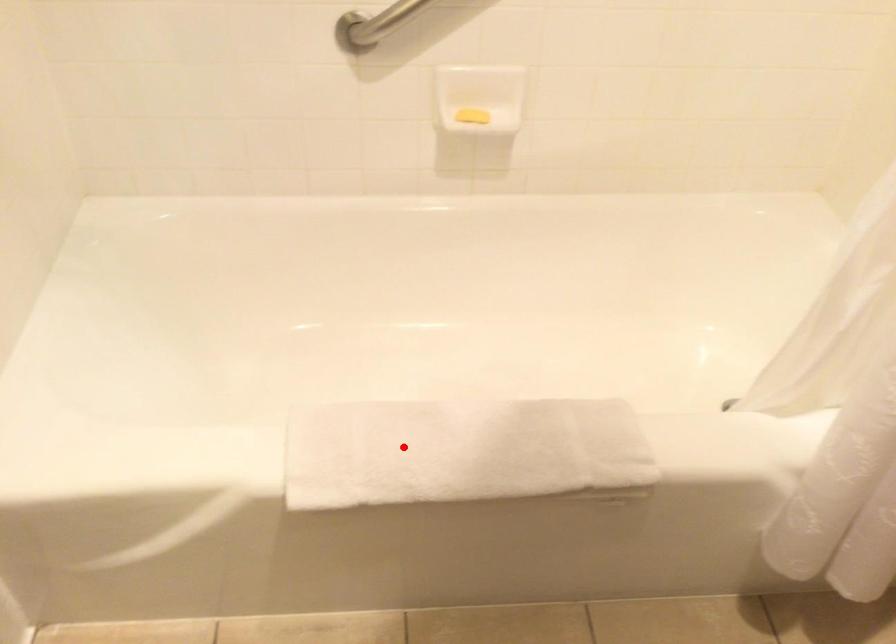
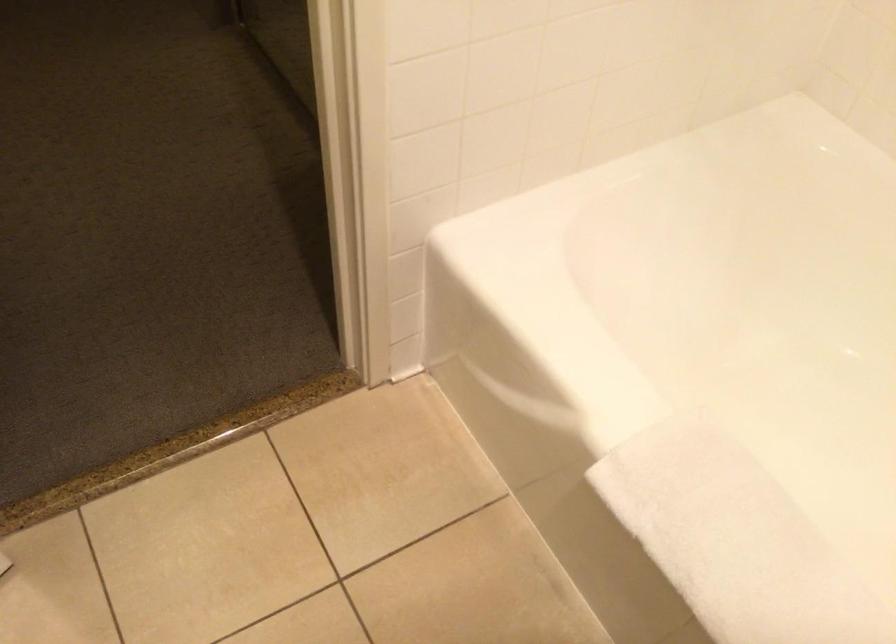
Question: I am providing you with two images of the same scene from different viewpoints. A red point is shown in image1. For the corresponding object point in image2, is it positioned nearer or farther from the camera?

Choices:
 (A) Nearer
 (B) Farther

Answer: (A)